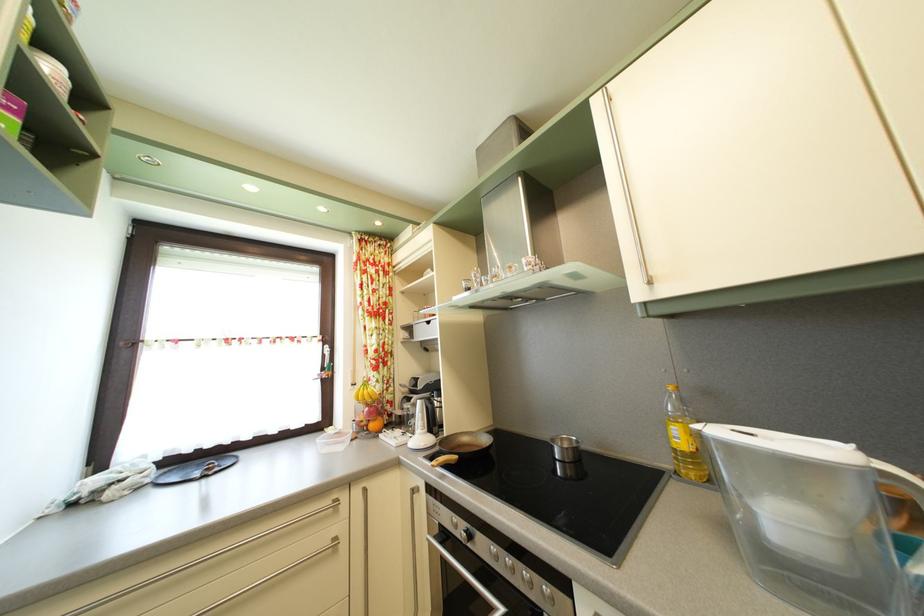
The width and height of the screenshot is (924, 616). What do you see at coordinates (816, 521) in the screenshot?
I see `the water pitcher handle` at bounding box center [816, 521].